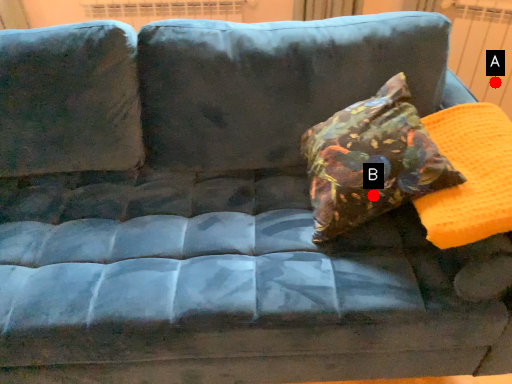
Question: Two points are circled on the image, labeled by A and B beside each circle. Which of the following is the farthest from the observer?

Choices:
 (A) A is further
 (B) B is further

Answer: (A)